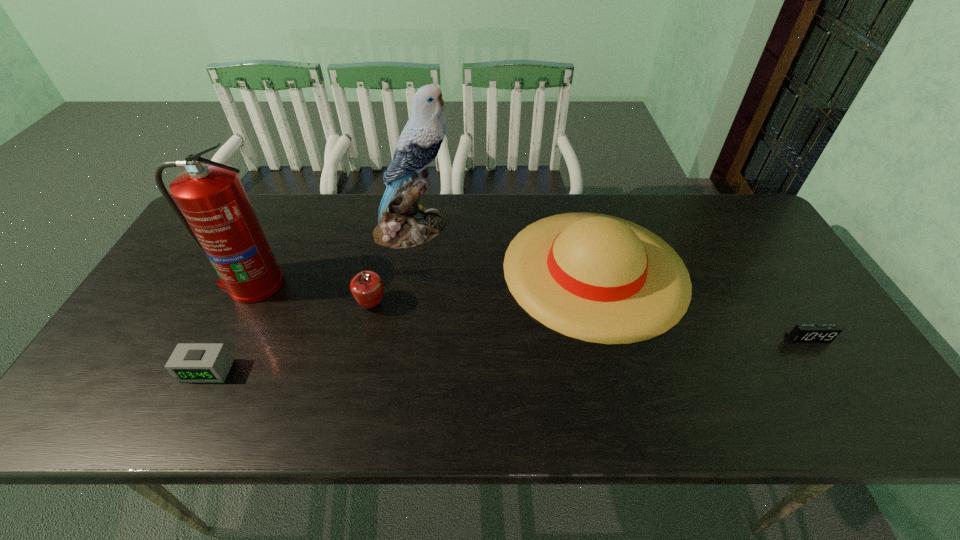
At what (x,y) coordinates should I click in order to perform the action: click on parakeet. Please return your answer as a coordinate pair (x, y). Looking at the image, I should click on [x=402, y=223].

You are a GUI agent. You are given a task and a screenshot of the screen. Output one action in this format:
    pyautogui.click(x=<x>, y=<y>)
    Task: Click on the fire extinguisher
    The height and width of the screenshot is (540, 960).
    Given the screenshot: What is the action you would take?
    pyautogui.click(x=215, y=210)

Locate an element on the screen. the second object from right to left is located at coordinates (598, 278).

Identify the location of the fourth shortest object. click(x=598, y=278).

Identify the location of the third shortest object. This screenshot has height=540, width=960. (366, 287).

Where is `the taller alarm clock`? the taller alarm clock is located at coordinates (190, 362).

Where is `the second shortest object`? Image resolution: width=960 pixels, height=540 pixels. the second shortest object is located at coordinates (190, 362).

Image resolution: width=960 pixels, height=540 pixels. Find the location of `the shortest object`. the shortest object is located at coordinates (802, 333).

Locate an element on the screen. the farther alarm clock is located at coordinates (802, 333).

Locate an element on the screen. vacant space located 0.370m on the face of the parakeet is located at coordinates click(x=569, y=228).